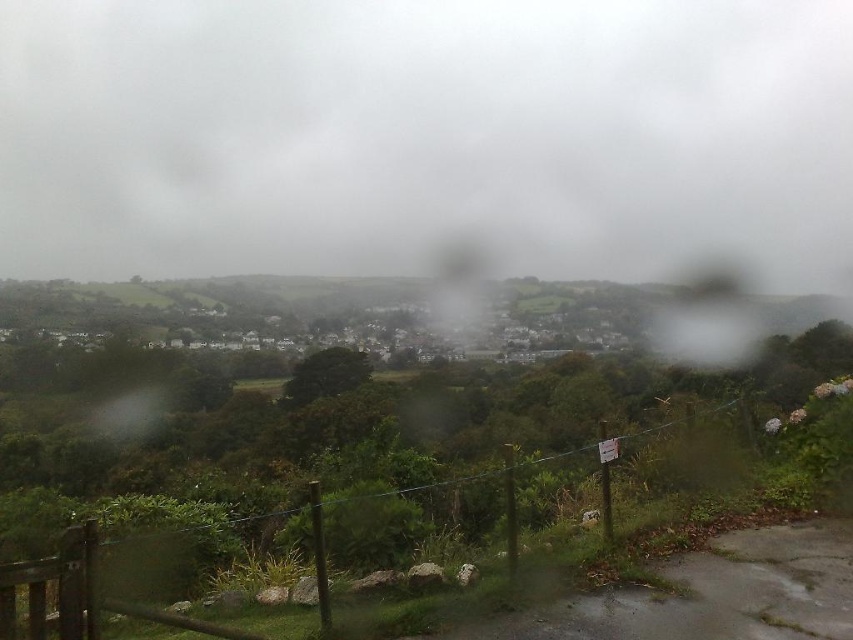
Question: Can you confirm if white fluffy cloud at upper center is positioned below wooden fence at lower center?

Choices:
 (A) no
 (B) yes

Answer: (A)

Question: Does white fluffy cloud at upper center have a lesser width compared to wooden fence at lower center?

Choices:
 (A) yes
 (B) no

Answer: (B)

Question: Which of the following is the closest to the observer?

Choices:
 (A) (292, 195)
 (B) (492, 468)

Answer: (B)

Question: In this image, where is white fluffy cloud at upper center located relative to wooden fence at lower center?

Choices:
 (A) right
 (B) left

Answer: (B)